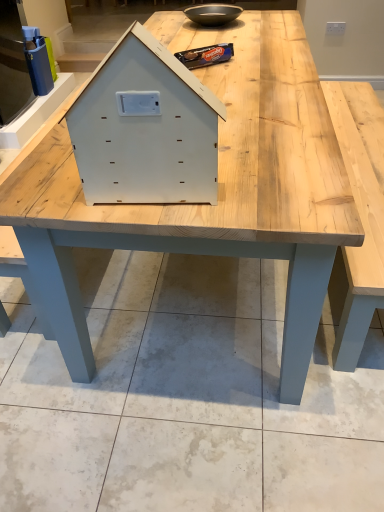
Find the location of a particular element. The image size is (384, 512). vacant area located to the right-hand side of white matte wooden house at center is located at coordinates (253, 188).